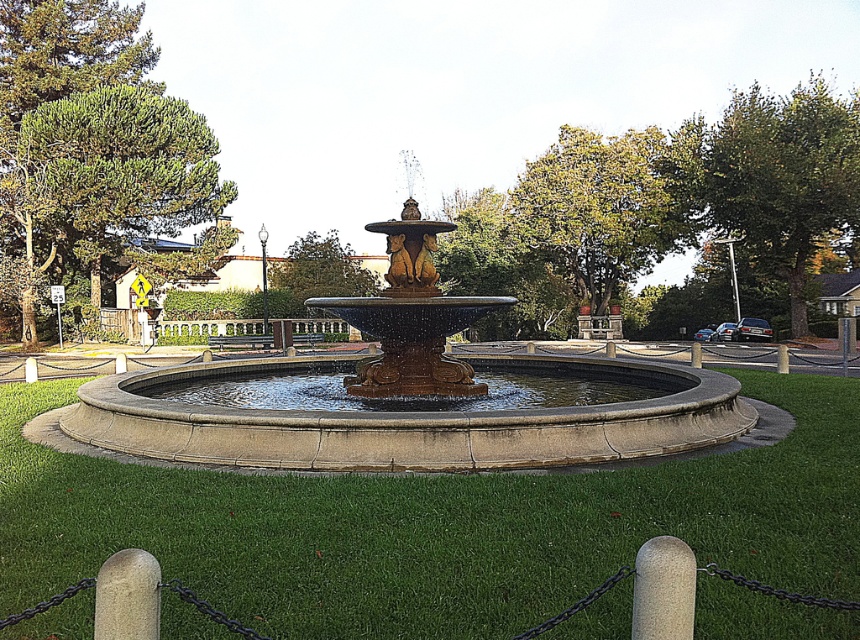
Question: Which point is farther to the camera?

Choices:
 (A) (630, 474)
 (B) (298, 465)

Answer: (B)

Question: Considering the relative positions of green grass at center and polished bronze fountain at center in the image provided, where is green grass at center located with respect to polished bronze fountain at center?

Choices:
 (A) left
 (B) right

Answer: (A)

Question: Among these points, which one is nearest to the camera?

Choices:
 (A) (241, 589)
 (B) (349, 429)

Answer: (A)

Question: Considering the relative positions of green grass at center and polished bronze fountain at center in the image provided, where is green grass at center located with respect to polished bronze fountain at center?

Choices:
 (A) below
 (B) above

Answer: (A)

Question: Is green grass at center closer to the viewer compared to polished bronze fountain at center?

Choices:
 (A) no
 (B) yes

Answer: (B)

Question: Among these objects, which one is farthest from the camera?

Choices:
 (A) polished bronze fountain at center
 (B) green grass at center

Answer: (A)